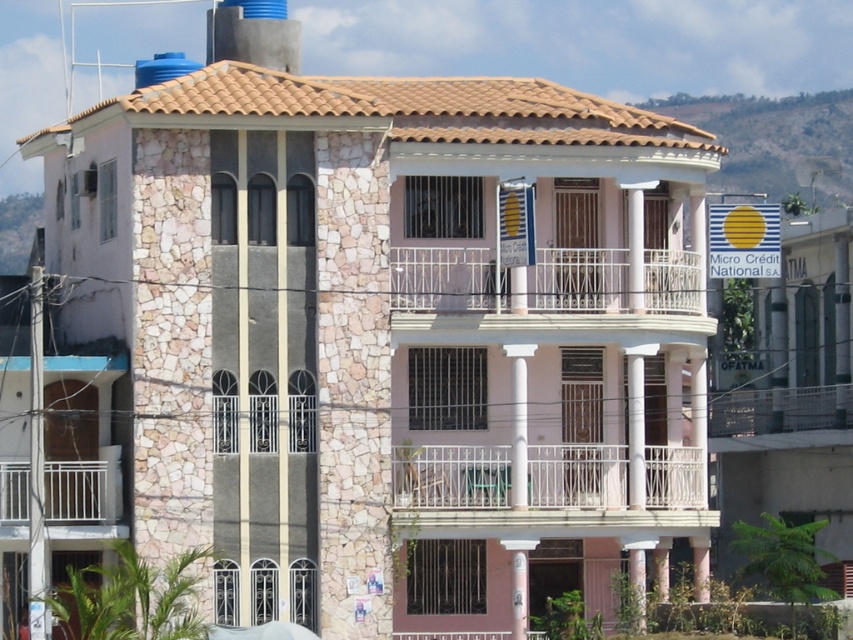
Is point (444, 504) more distant than point (654, 294)?

No, (444, 504) is in front of (654, 294).

Is point (410, 531) positioned after point (654, 317)?

No.

Where is `white metal balcony at center`? This screenshot has height=640, width=853. white metal balcony at center is located at coordinates (544, 492).

Can you confirm if white wrought iron balcony at center is shorter than white metal balcony at lower left?

Yes.

Does point (550, 289) come farther from viewer compared to point (61, 497)?

Yes, it is.

Between point (660, 257) and point (21, 520), which one is positioned in front?

Point (21, 520) is more forward.

Identify the location of white wrought iron balcony at center. (544, 296).

In the scene shown: Is white metal balcony at center below white metal balcony at lower left?

No, white metal balcony at center is not below white metal balcony at lower left.

Based on the photo, can you confirm if white metal balcony at center is taller than white metal balcony at lower left?

No, white metal balcony at center is not taller than white metal balcony at lower left.

Locate an element on the screen. This screenshot has height=640, width=853. white metal balcony at center is located at coordinates point(544,492).